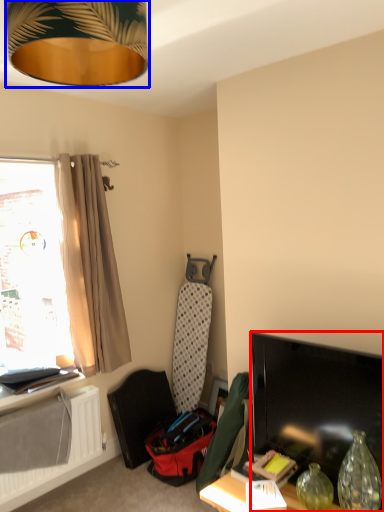
Question: Among these objects, which one is nearest to the camera, television (highlighted by a red box) or lamp (highlighted by a blue box)?

Choices:
 (A) television
 (B) lamp

Answer: (B)